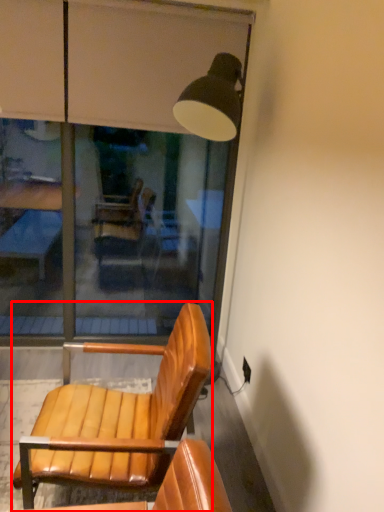
Question: Observing the image, what is the correct spatial positioning of chair (annotated by the red box) in reference to glass window?

Choices:
 (A) left
 (B) right

Answer: (B)